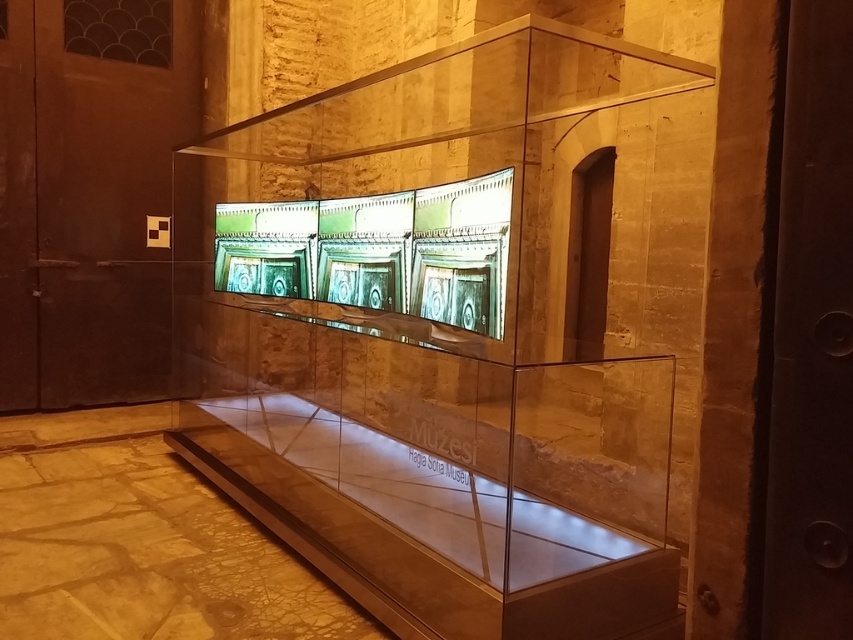
Can you confirm if transparent glass display case at center is bigger than transparent glass table at center?

Correct, transparent glass display case at center is larger in size than transparent glass table at center.

Can you confirm if transparent glass display case at center is positioned above transparent glass table at center?

Yes.

Does point (578, 301) lie in front of point (442, 550)?

No, (578, 301) is further to viewer.

What are the coordinates of `transparent glass display case at center` in the screenshot? It's located at (451, 330).

Is brown wooden door at left positioned at the back of transparent glass table at center?

Yes.

Does brown wooden door at left have a smaller size compared to transparent glass table at center?

No, brown wooden door at left is not smaller than transparent glass table at center.

I want to click on brown wooden door at left, so click(x=90, y=195).

Find the location of `brown wooden door at left`. brown wooden door at left is located at coordinates (90, 195).

Does transparent glass display case at center lie behind brown wooden door at left?

That is False.

Between transparent glass display case at center and brown wooden door at left, which one is positioned higher?

brown wooden door at left is above.

You are a GUI agent. You are given a task and a screenshot of the screen. Output one action in this format:
    pyautogui.click(x=<x>, y=<y>)
    Task: Click on the transparent glass display case at center
    
    Given the screenshot: What is the action you would take?
    pyautogui.click(x=451, y=330)